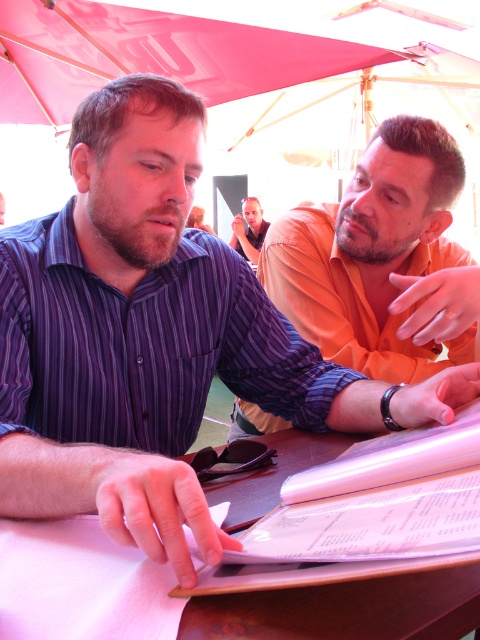
Which is behind, point (434, 352) or point (269, 614)?

The point (434, 352) is behind.

Does point (416, 362) lie in front of point (354, 612)?

No, it is not.

At what (x,y) coordinates should I click in order to perform the action: click on orange matte shirt at upper right. Please return your answer as a coordinate pair (x, y). Looking at the image, I should click on pos(382,259).

Who is positioned more to the right, pink fabric canopy at upper center or matte orange shirt at center?

Positioned to the right is matte orange shirt at center.

Is pink fabric canopy at upper center further to the viewer compared to matte orange shirt at center?

No, pink fabric canopy at upper center is in front of matte orange shirt at center.

Where is `pink fabric canopy at upper center`? Image resolution: width=480 pixels, height=640 pixels. pink fabric canopy at upper center is located at coordinates pyautogui.click(x=153, y=54).

Is purple striped shirt at left shorter than matte orange shirt at center?

Indeed, purple striped shirt at left has a lesser height compared to matte orange shirt at center.

Is point (286, 346) closer to viewer compared to point (252, 196)?

Yes, point (286, 346) is closer to viewer.

Is point (195, 324) positioned behind point (243, 237)?

No, (195, 324) is in front of (243, 237).

Where is `purple striped shirt at left`? Image resolution: width=480 pixels, height=640 pixels. purple striped shirt at left is located at coordinates (144, 342).